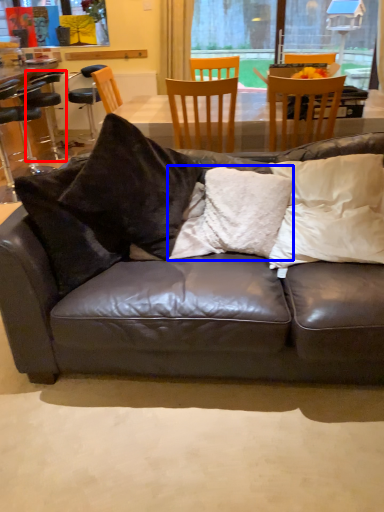
Question: Which point is closer to the camera, bar stool (highlighted by a red box) or pillow (highlighted by a blue box)?

Choices:
 (A) bar stool
 (B) pillow

Answer: (B)